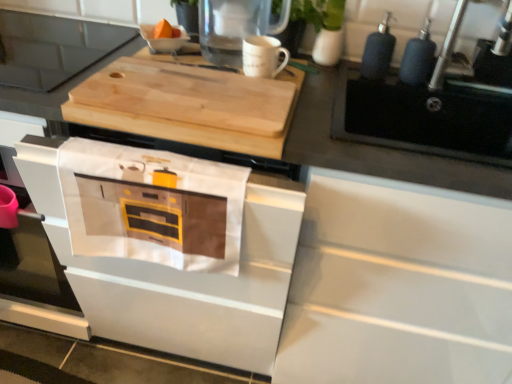
Image resolution: width=512 pixels, height=384 pixels. I want to click on vacant space in clear glass pitcher at upper center (from a real-world perspective), so click(x=224, y=58).